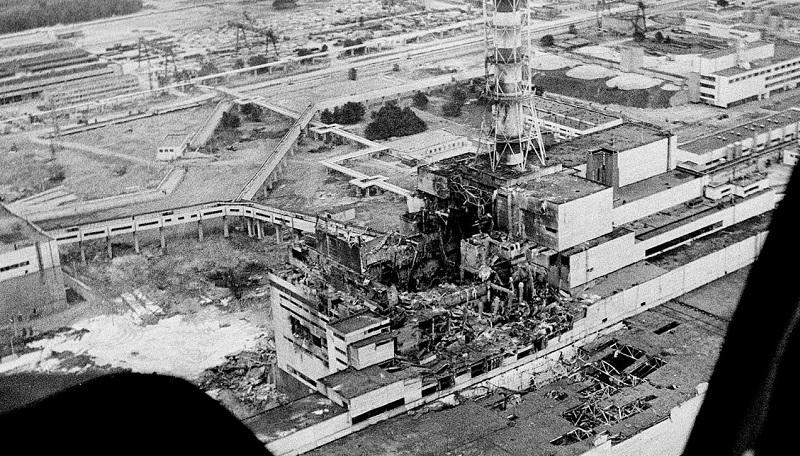
Where is `window`? The image size is (800, 456). window is located at coordinates (730, 78).